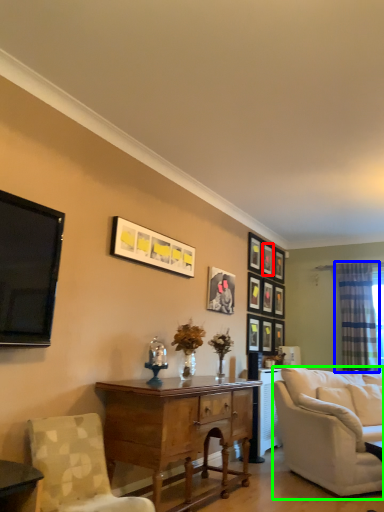
Question: Based on their relative distances, which object is nearer to picture frame (highlighted by a red box)? Choose from curtain (highlighted by a blue box) and studio couch (highlighted by a green box).

Choices:
 (A) curtain
 (B) studio couch

Answer: (A)